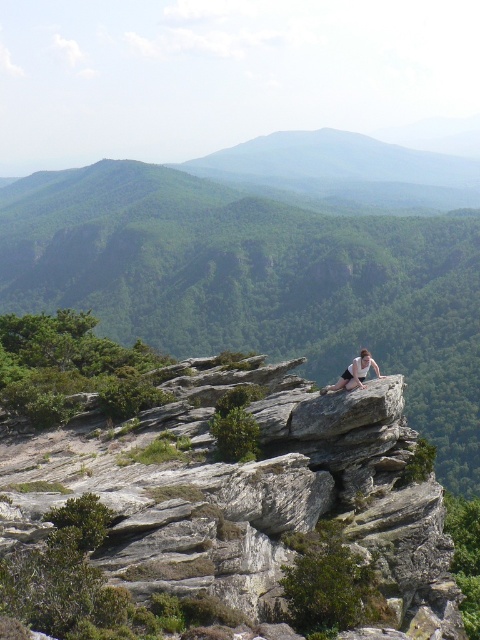
Who is positioned more to the left, gray rough rock at center or light brown skin at center?

gray rough rock at center is more to the left.

Between point (363, 452) and point (362, 353), which one is positioned behind?

The point (362, 353) is more distant.

This screenshot has width=480, height=640. In order to click on gray rough rock at center in this screenshot , I will do `click(230, 516)`.

The height and width of the screenshot is (640, 480). What do you see at coordinates (345, 172) in the screenshot?
I see `green matte mountain at center` at bounding box center [345, 172].

Is green matte mountain at center thinner than light brown skin at center?

In fact, green matte mountain at center might be wider than light brown skin at center.

Who is more forward, (349, 157) or (348, 381)?

Point (348, 381) is more forward.

Identify the location of green matte mountain at center. (345, 172).

How much distance is there between gray rough rock at center and green matte mountain at center?

gray rough rock at center is 553.34 meters from green matte mountain at center.

Can you confirm if gray rough rock at center is positioned below green matte mountain at center?

Yes.

Image resolution: width=480 pixels, height=640 pixels. I want to click on gray rough rock at center, so point(230,516).

Identify the location of gray rough rock at center. (230, 516).